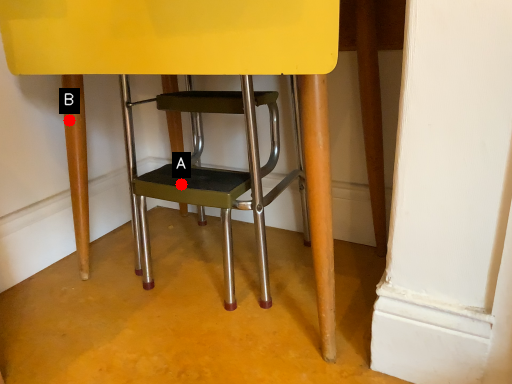
Question: Two points are circled on the image, labeled by A and B beside each circle. Which of the following is the farthest from the observer?

Choices:
 (A) A is further
 (B) B is further

Answer: (B)